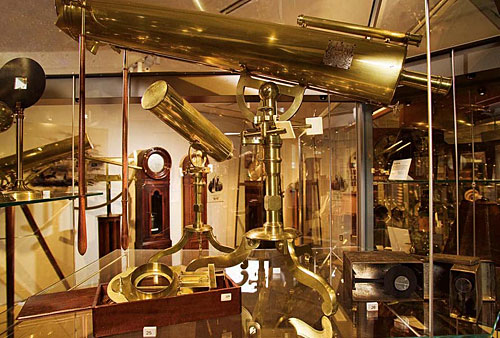
At what (x,y) coordinates should I click in order to perform the action: click on grandfather clock. Please return your answer as a coordinate pair (x, y). The width and height of the screenshot is (500, 338). Looking at the image, I should click on (160, 187).